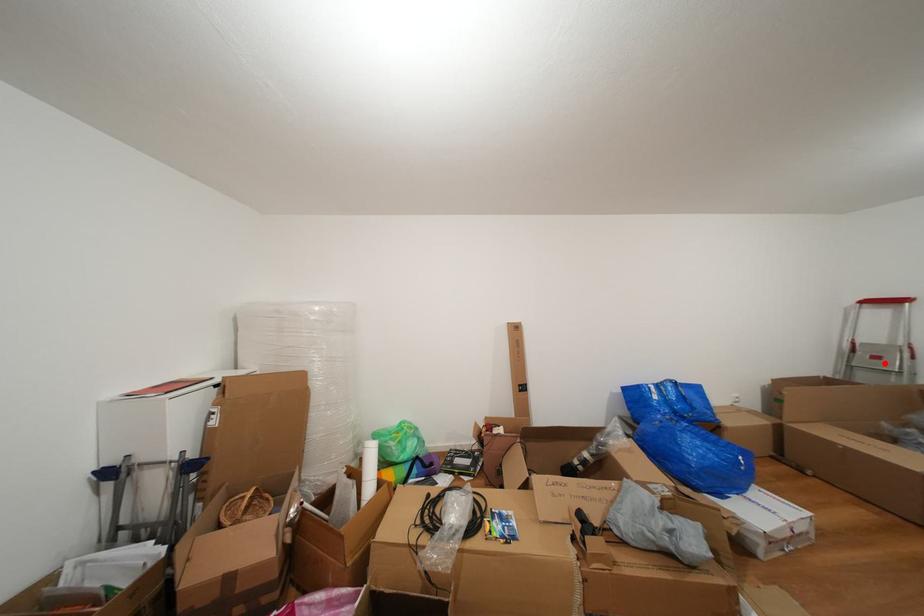
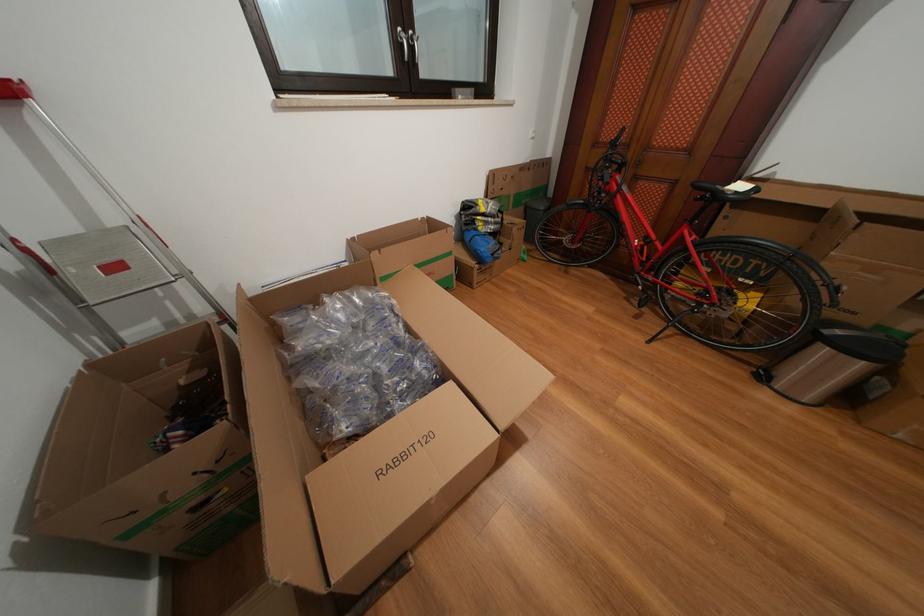
Locate, in the second image, the point that corresponds to the highlighted location in the first image.

(124, 273)